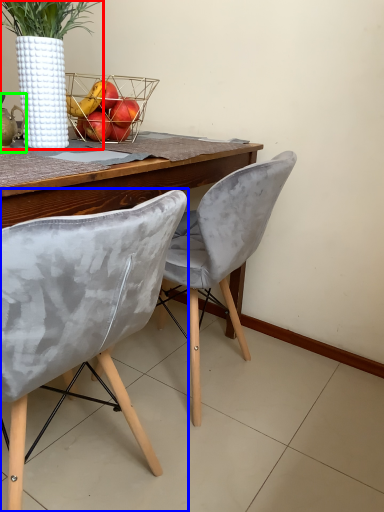
Question: Estimate the real-world distances between objects in this image. Which object is closer to houseplant (highlighted by a red box), chair (highlighted by a blue box) or tea pot (highlighted by a green box)?

Choices:
 (A) chair
 (B) tea pot

Answer: (B)